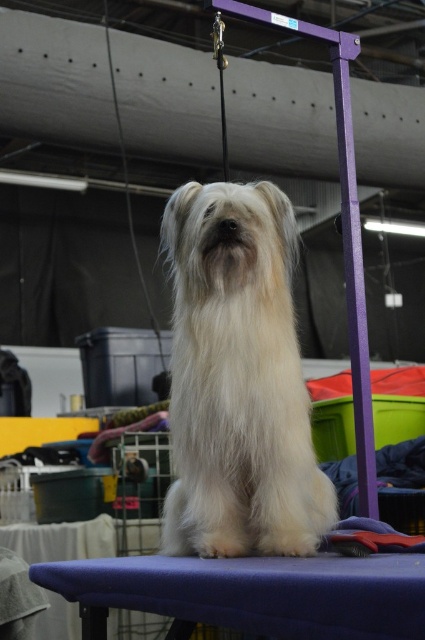
You are a groomer at a dog show. You need to place a blue fabric stool at lower center under the white fluffy dog at center to support its paws. Is the stool currently positioned correctly?

The white fluffy dog at center is located above blue fabric stool at lower center, so the stool is already positioned correctly under the dog to support its paws.